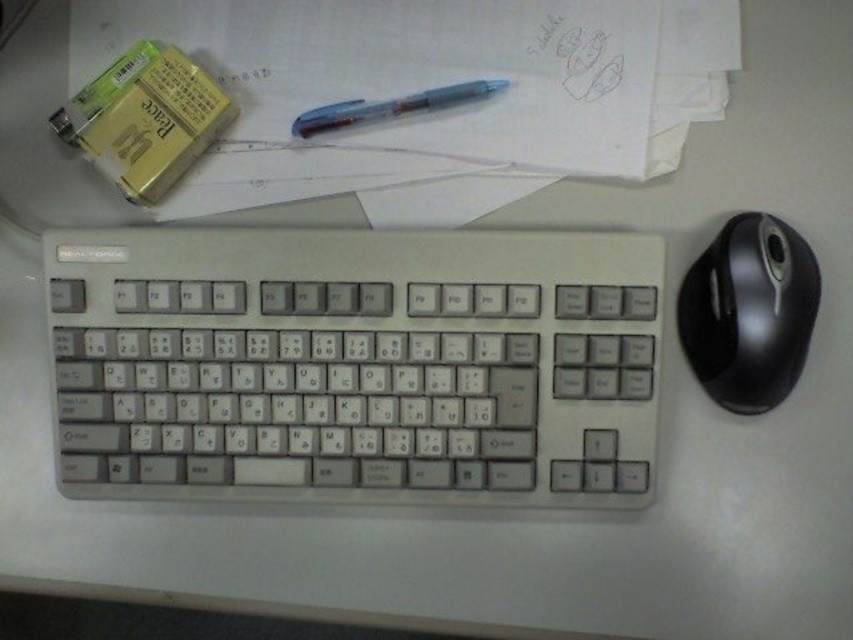
Is black rubberized mouse at right to the right of gold metallic battery at upper left from the viewer's perspective?

Correct, you'll find black rubberized mouse at right to the right of gold metallic battery at upper left.

Who is positioned more to the right, black rubberized mouse at right or gold metallic battery at upper left?

Positioned to the right is black rubberized mouse at right.

The width and height of the screenshot is (853, 640). What do you see at coordinates (749, 312) in the screenshot?
I see `black rubberized mouse at right` at bounding box center [749, 312].

The image size is (853, 640). Find the location of `black rubberized mouse at right`. black rubberized mouse at right is located at coordinates (749, 312).

Who is positioned more to the right, white paper at upper center or black rubberized mouse at right?

Positioned to the right is black rubberized mouse at right.

Is point (618, 99) positioned after point (769, 384)?

Yes.

The width and height of the screenshot is (853, 640). What are the coordinates of `white paper at upper center` in the screenshot? It's located at coord(431,86).

Is white plastic keyboard at center closer to the viewer compared to translucent plastic pen at center?

Yes, it is in front of translucent plastic pen at center.

Is point (55, 410) positioned behind point (471, 83)?

No, (55, 410) is closer to viewer.

The image size is (853, 640). What are the coordinates of `white plastic keyboard at center` in the screenshot? It's located at (357, 364).